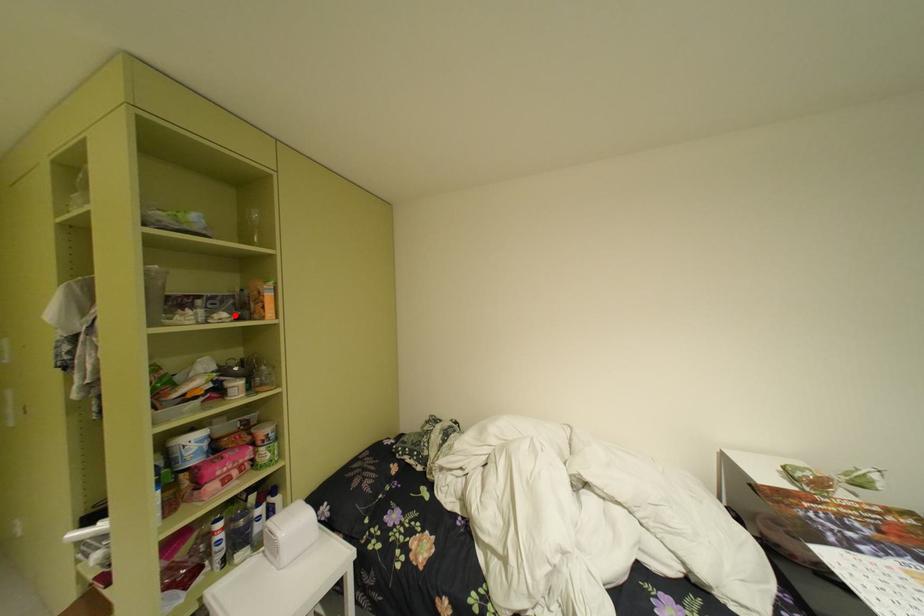
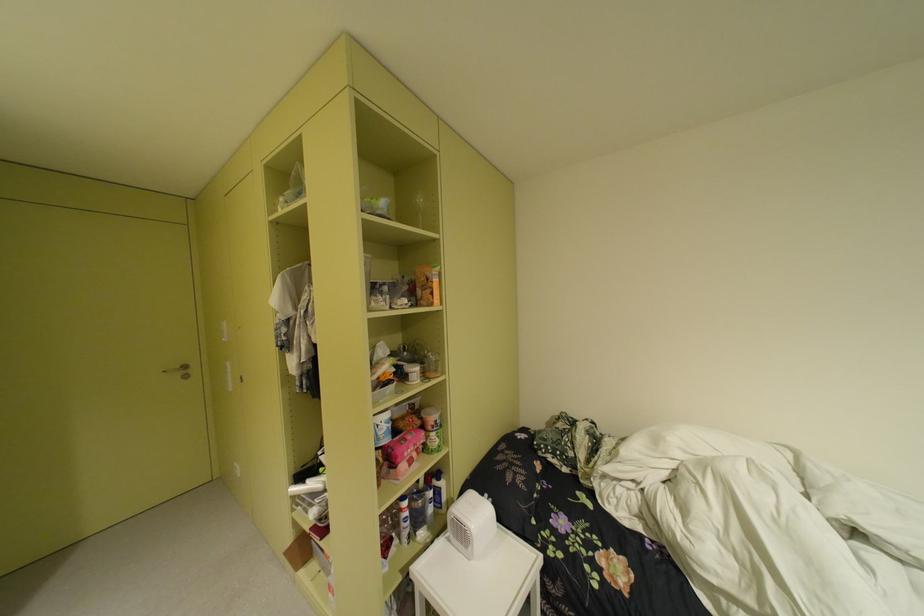
In the second image, find the point that corresponds to the highlighted location in the first image.

(417, 301)